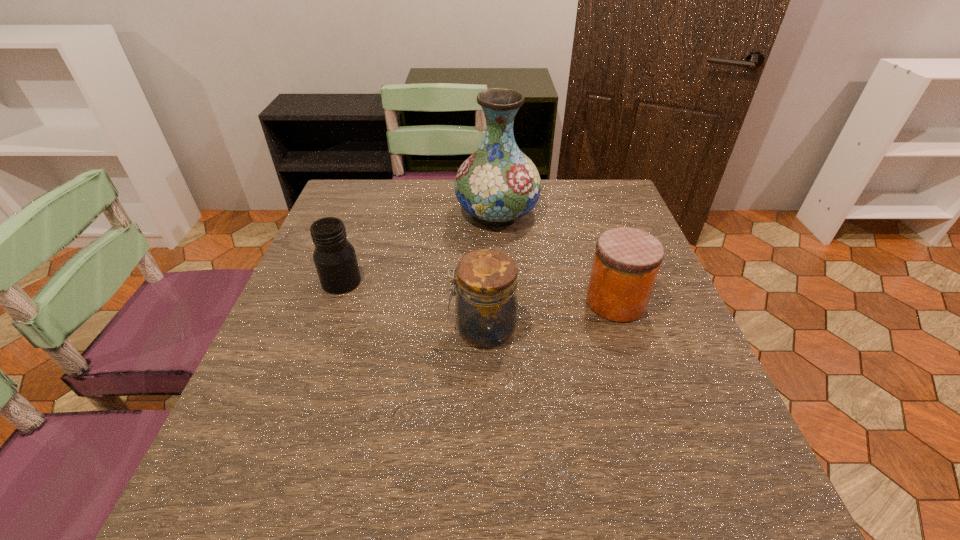
Identify the location of free area in between the tallest object and the rightmost jar. (556, 258).

Where is `empty space that is in between the rightmost object and the vase`? Image resolution: width=960 pixels, height=540 pixels. empty space that is in between the rightmost object and the vase is located at coordinates (556, 258).

Locate an element on the screen. empty space between the rightmost object and the tallest object is located at coordinates (556, 258).

This screenshot has width=960, height=540. In order to click on empty space between the second jar from right to left and the rightmost jar in this screenshot , I will do `click(549, 315)`.

The image size is (960, 540). Find the location of `free space that is in between the second jar from left to right and the leftmost object`. free space that is in between the second jar from left to right and the leftmost object is located at coordinates (412, 305).

You are a GUI agent. You are given a task and a screenshot of the screen. Output one action in this format:
    pyautogui.click(x=<x>, y=<y>)
    Task: Click on the unoccupied position between the leftmost object and the farthest object
    Image resolution: width=960 pixels, height=540 pixels.
    Given the screenshot: What is the action you would take?
    tap(420, 247)

Identify the location of free space between the second jar from left to right and the rightmost object. (549, 315).

Where is `object that can be found as the second closest to the rightmost jar`? The image size is (960, 540). object that can be found as the second closest to the rightmost jar is located at coordinates (498, 183).

Where is `object that stands as the third closest to the farthest object`? Image resolution: width=960 pixels, height=540 pixels. object that stands as the third closest to the farthest object is located at coordinates (486, 283).

The width and height of the screenshot is (960, 540). Identify the location of the closest jar to the leftmost object. (486, 283).